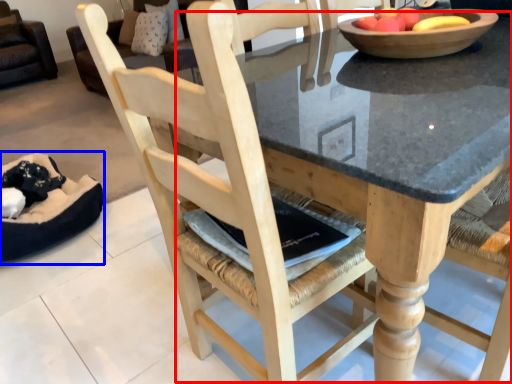
Question: Which point is closer to the camera, round table (highlighted by a red box) or bean bag chair (highlighted by a blue box)?

Choices:
 (A) round table
 (B) bean bag chair

Answer: (A)